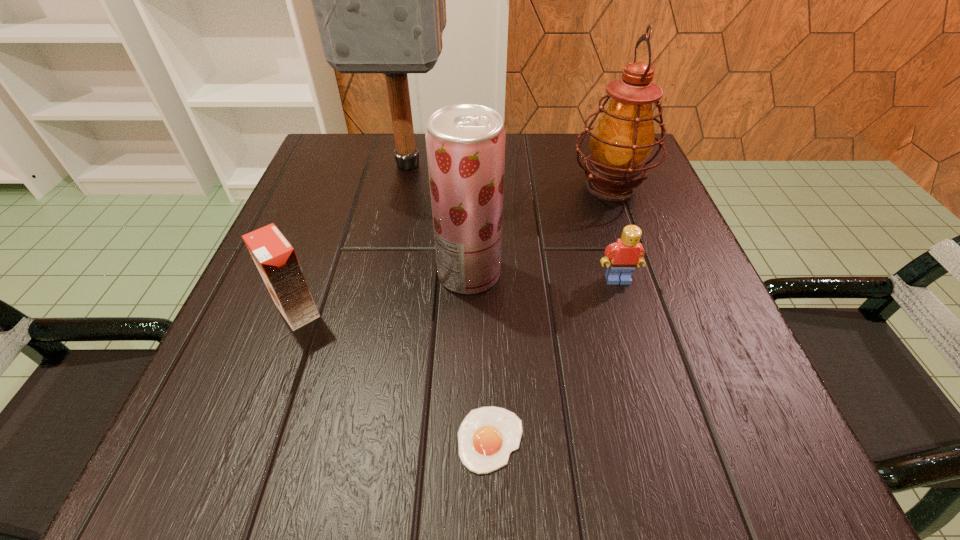
Where is `vacant space positioned on the front of the orange juice`? vacant space positioned on the front of the orange juice is located at coordinates (246, 450).

The image size is (960, 540). In order to click on vacant space situated 0.280m on the front-facing side of the fifth tallest object in this screenshot , I will do `click(670, 455)`.

At what (x,y) coordinates should I click in order to perform the action: click on free space located on the back of the nearest object. Please return your answer as a coordinate pair (x, y). Looking at the image, I should click on tap(489, 355).

Locate an element on the screen. This screenshot has height=540, width=960. mallet positioned at the far edge is located at coordinates (379, 0).

At what (x,y) coordinates should I click in order to perform the action: click on oil lamp that is at the far edge. Please return your answer as a coordinate pair (x, y). The width and height of the screenshot is (960, 540). Looking at the image, I should click on (622, 140).

At what (x,y) coordinates should I click in order to perform the action: click on object situated at the near edge. Please return your answer as a coordinate pair (x, y). Looking at the image, I should click on (487, 435).

You are a GUI agent. You are given a task and a screenshot of the screen. Output one action in this format:
    pyautogui.click(x=<x>, y=<y>)
    Task: Click on the mallet that is at the left edge
    
    Given the screenshot: What is the action you would take?
    pyautogui.click(x=379, y=0)

Identify the location of orange juice located at the left edge. (275, 258).

Where is `oil lamp present at the right edge`? The image size is (960, 540). oil lamp present at the right edge is located at coordinates (622, 140).

Find the location of `Lego that is positioned at the right edge`. Lego that is positioned at the right edge is located at coordinates (625, 255).